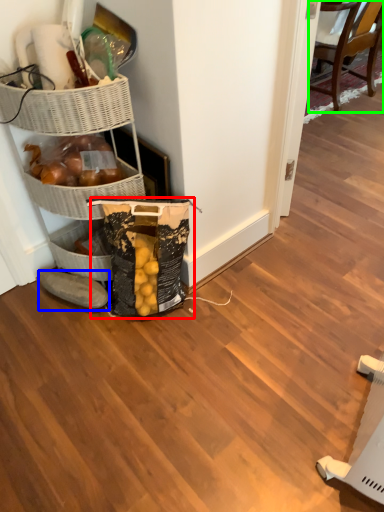
Question: Based on their relative distances, which object is farther from grocery bag (highlighted by a red box)? Choose from footwear (highlighted by a blue box) and chair (highlighted by a green box).

Choices:
 (A) footwear
 (B) chair

Answer: (B)